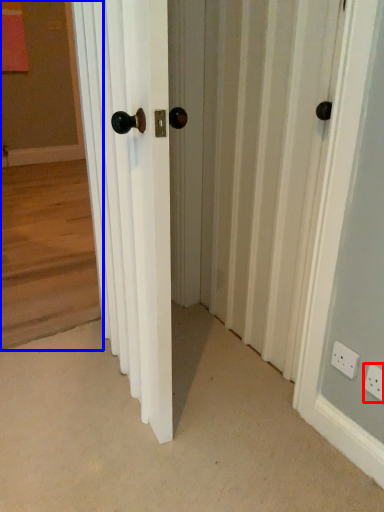
Question: Which object appears closest to the camera in this image, electric outlet (highlighted by a red box) or corridor (highlighted by a blue box)?

Choices:
 (A) electric outlet
 (B) corridor

Answer: (A)